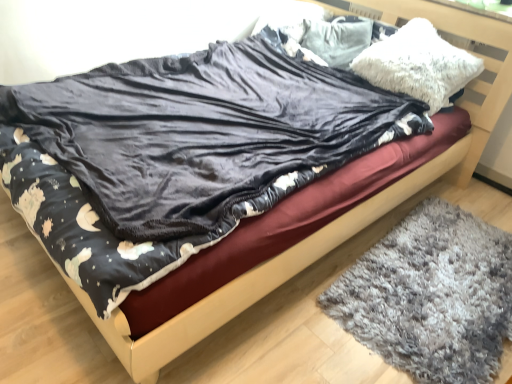
This screenshot has height=384, width=512. Identify the location of free spot below gray shaggy rug at lower right (from a real-world perspective). (433, 277).